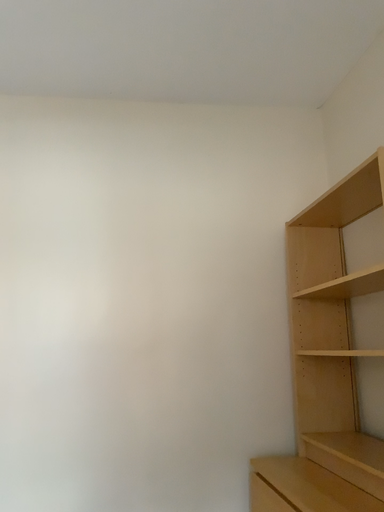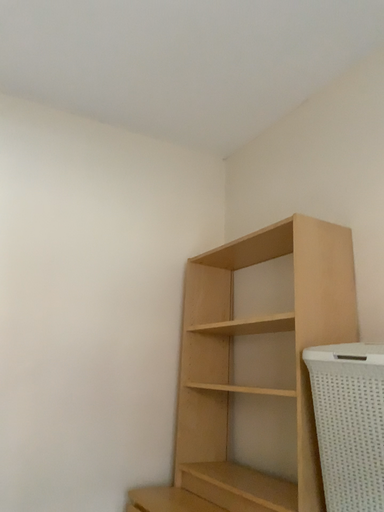
Question: How did the camera likely rotate when shooting the video?

Choices:
 (A) rotated right
 (B) rotated left

Answer: (A)